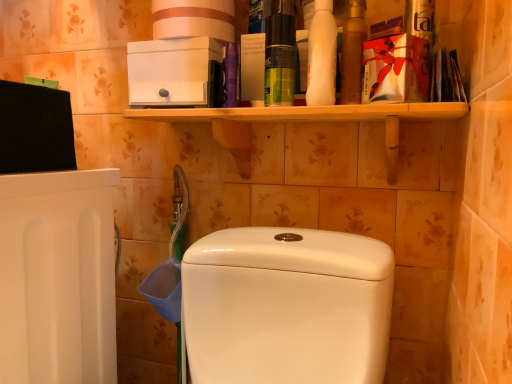
Question: Considering the positions of point (342, 89) and point (325, 31), is point (342, 89) closer or farther from the camera than point (325, 31)?

Choices:
 (A) closer
 (B) farther

Answer: (B)

Question: In terms of width, does gold metallic mouthwash at upper right look wider or thinner when compared to white matte bottle at upper right, the 1th cleaning product when ordered from right to left?

Choices:
 (A) wide
 (B) thin

Answer: (B)

Question: Which object is the farthest from the white cardboard toilet paper at upper center?

Choices:
 (A) green matte spray can at upper center, the second cleaning product positioned from the right
 (B) white glossy toilet at center
 (C) white matte bottle at upper right, the 1th cleaning product when ordered from right to left
 (D) gold metallic mouthwash at upper right

Answer: (B)

Question: Based on their relative distances, which object is farther from the white glossy toilet at center?

Choices:
 (A) green matte spray can at upper center, which is the first cleaning product in left-to-right order
 (B) white matte bottle at upper right, arranged as the second cleaning product when viewed from the left
 (C) gold metallic mouthwash at upper right
 (D) white cardboard toilet paper at upper center

Answer: (D)